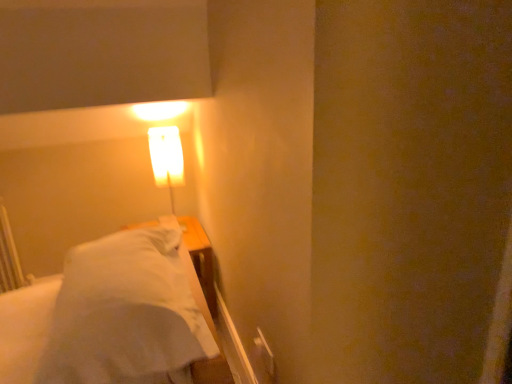
I want to click on free space above matte white lamp at upper left (from a real-world perspective), so click(x=160, y=132).